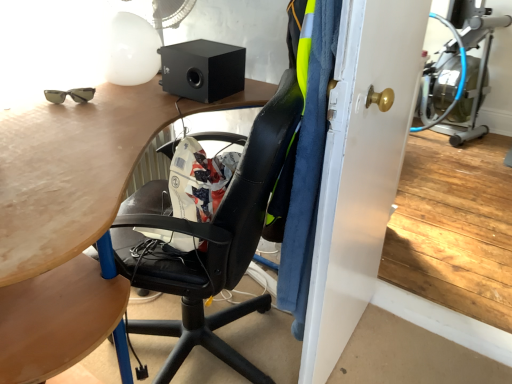
Find the location of a particular element. unoccupied region to the right of matte gold door handle at center is located at coordinates (412, 348).